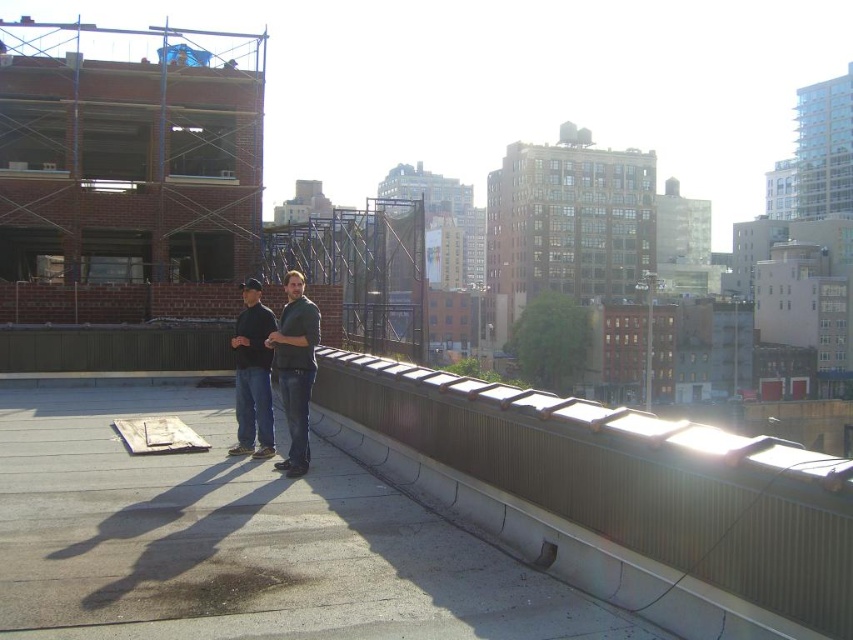
Question: Observing the image, what is the correct spatial positioning of metallic gray rail at upper right in reference to dark gray blazer at center?

Choices:
 (A) left
 (B) right

Answer: (B)

Question: Which of the following is the closest to the observer?

Choices:
 (A) (830, 593)
 (B) (300, 448)
 (C) (252, 342)

Answer: (A)

Question: Estimate the real-world distances between objects in this image. Which object is farther from the dark gray blazer at center?

Choices:
 (A) gray concrete pavement at center
 (B) metallic gray rail at upper right
 (C) dark gray sweater at center

Answer: (B)

Question: Is metallic gray rail at upper right above dark gray blazer at center?

Choices:
 (A) no
 (B) yes

Answer: (A)

Question: Does gray concrete pavement at center appear on the right side of metallic gray rail at upper right?

Choices:
 (A) no
 (B) yes

Answer: (A)

Question: Which of the following is the closest to the observer?

Choices:
 (A) dark gray sweater at center
 (B) gray concrete pavement at center
 (C) metallic gray rail at upper right

Answer: (C)